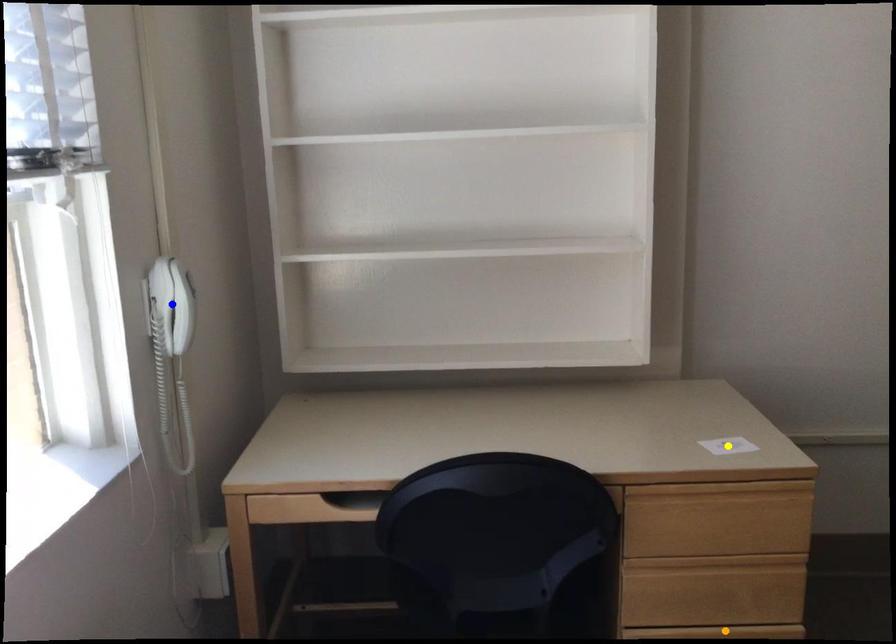
Order these from nearest to farthest:
orange point
yellow point
blue point

blue point, orange point, yellow point